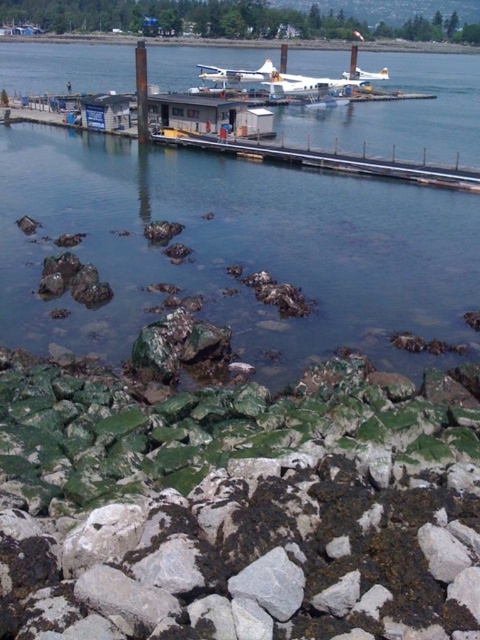
You are standing at the rocky shoreline in the waterfront scene. You want to reach the smooth concrete pier at upper center located at point (x=324, y=160). What obstacles might you encounter along the way?

The rocky shoreline with irregularly shaped rocks of varying sizes and patches of green algae or moss could pose obstacles. These rocks may be slippery due to the algae and uneven terrain, making the path to the smooth concrete pier at upper center challenging.

You are a photographer trying to capture the green mossy rocks at lower center and the smooth concrete dock at upper center in the same frame. Given that the camera has a fixed focal length, which object should you move closer to in order to include both in the frame without zooming?

Since the green mossy rocks at lower center are narrower than the smooth concrete dock at upper center, you should move closer to the green mossy rocks at lower center to ensure both fit in the frame without zooming.